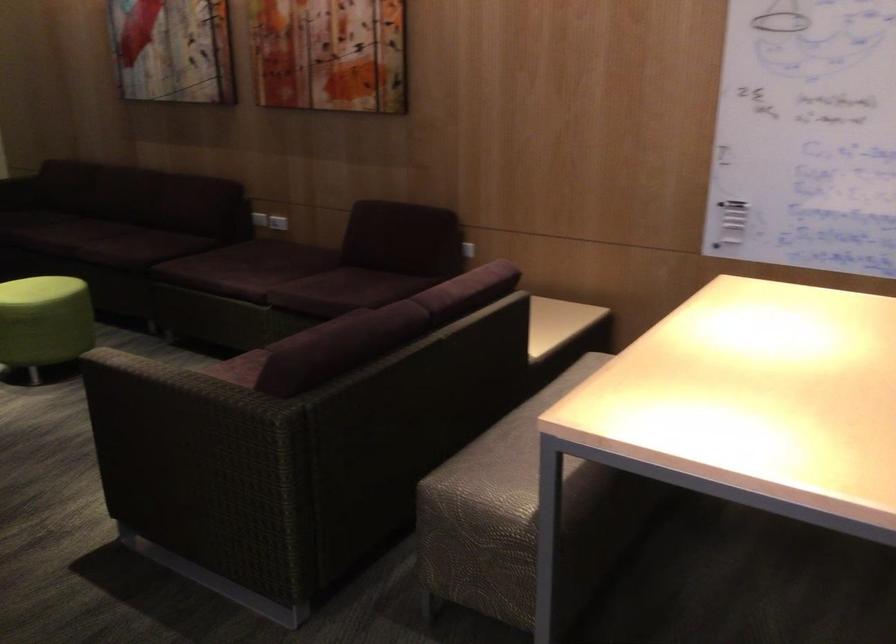
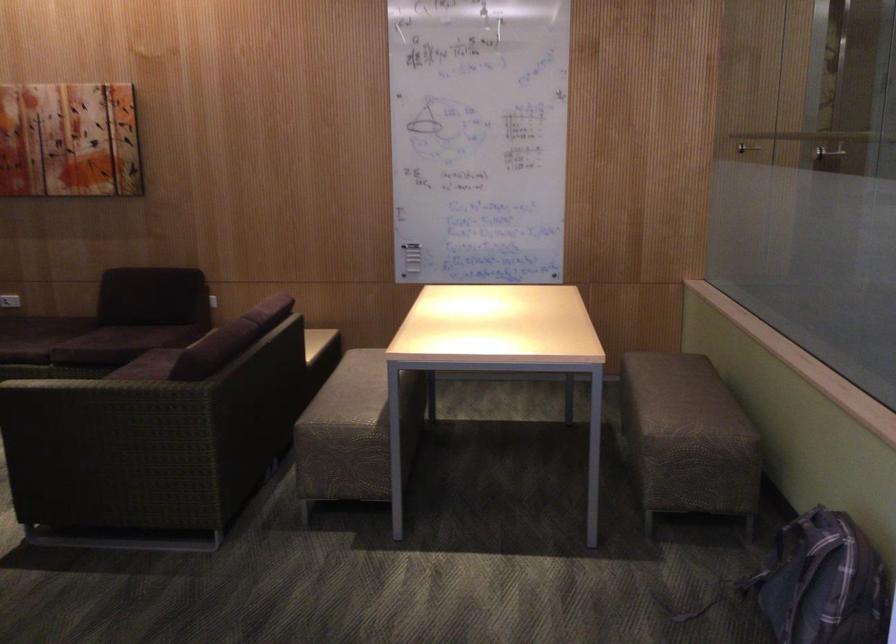
Locate, in the second image, the point that corresponds to pixel 277 229 in the first image.

(10, 301)